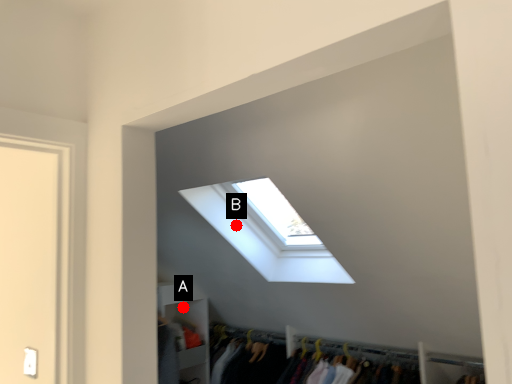
Question: Two points are circled on the image, labeled by A and B beside each circle. Which point is closer to the camera?

Choices:
 (A) A is closer
 (B) B is closer

Answer: (B)